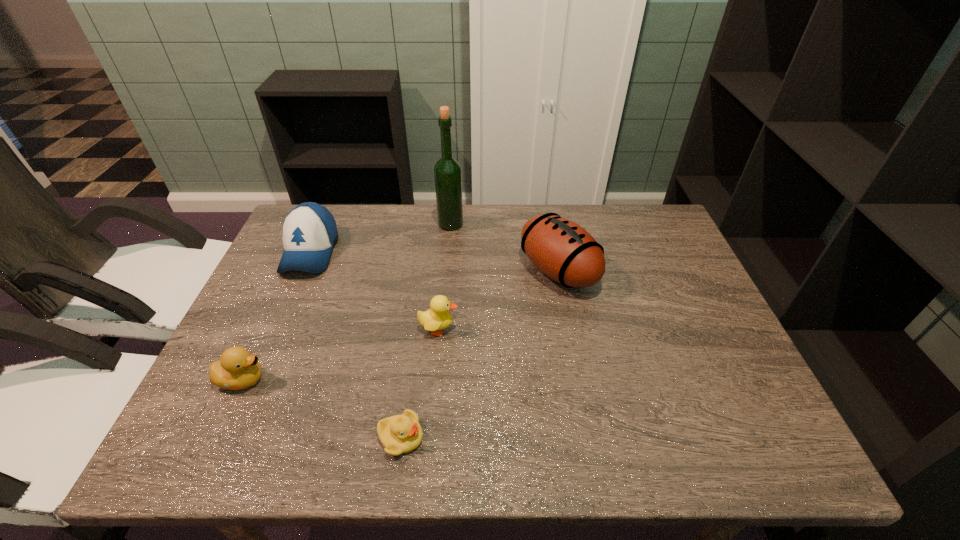
Identify the location of duckling that is the third closest to the third tallest object. (399, 434).

Image resolution: width=960 pixels, height=540 pixels. I want to click on duckling object that ranks as the second closest to the liquor, so click(x=238, y=369).

At what (x,y) coordinates should I click in order to perform the action: click on free spot that satisfies the following two spatial constraints: 1. on the front side of the liquor; 2. on the front-facing side of the third nearest object. Please return your answer as a coordinate pair (x, y). The height and width of the screenshot is (540, 960). Looking at the image, I should click on (443, 329).